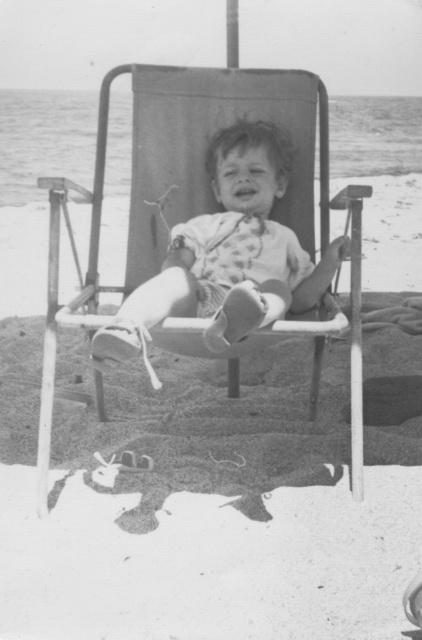
Question: In this image, where is metallic fabric beach chair at center located relative to matte white toddler at center?

Choices:
 (A) below
 (B) above

Answer: (A)

Question: Is metallic fabric beach chair at center to the right of matte white toddler at center from the viewer's perspective?

Choices:
 (A) yes
 (B) no

Answer: (B)

Question: Can you confirm if metallic fabric beach chair at center is positioned above matte white toddler at center?

Choices:
 (A) yes
 (B) no

Answer: (B)